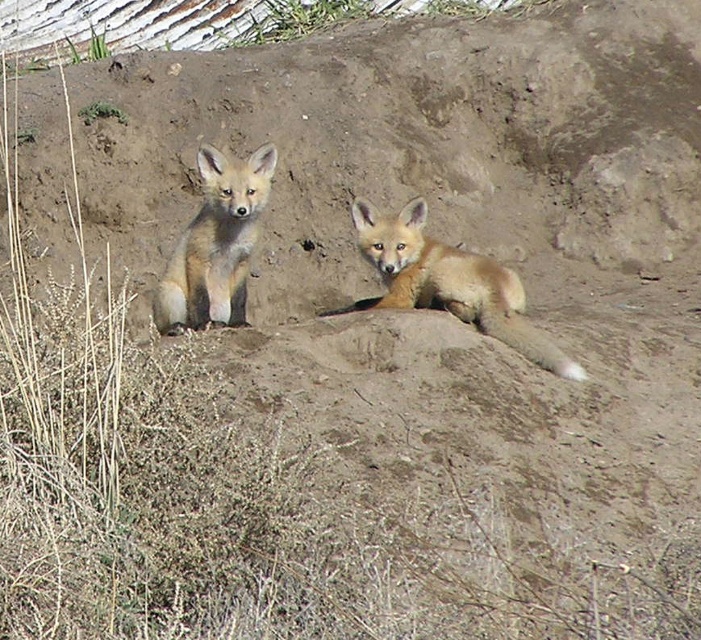
Question: Which object is closer to the camera taking this photo?

Choices:
 (A) golden fur fox at center
 (B) fuzzy brown fox at left

Answer: (A)

Question: Which point is farther to the camera?

Choices:
 (A) (456, 298)
 (B) (224, 292)

Answer: (B)

Question: Is golden fur fox at center positioned at the back of fuzzy brown fox at left?

Choices:
 (A) no
 (B) yes

Answer: (A)

Question: Which point is farther from the camera taking this photo?

Choices:
 (A) (383, 301)
 (B) (217, 291)

Answer: (A)

Question: Does golden fur fox at center have a larger size compared to fuzzy brown fox at left?

Choices:
 (A) no
 (B) yes

Answer: (B)

Question: Does golden fur fox at center come in front of fuzzy brown fox at left?

Choices:
 (A) yes
 (B) no

Answer: (A)